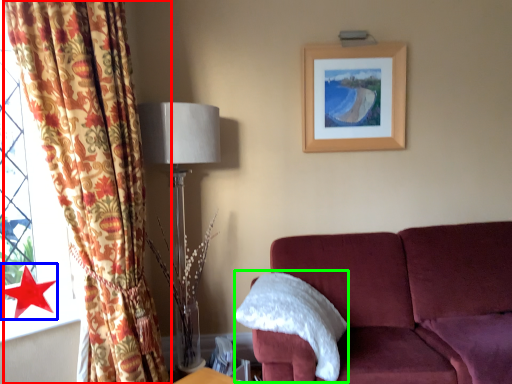
Question: Considering the real-world distances, which object is closest to curtain (highlighted by a red box)? star (highlighted by a blue box) or pillow (highlighted by a green box).

Choices:
 (A) star
 (B) pillow

Answer: (A)